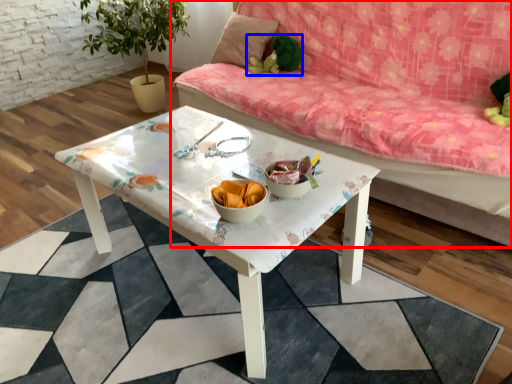
Question: Which object appears farthest to the camera in this image, studio couch (highlighted by a red box) or toy (highlighted by a blue box)?

Choices:
 (A) studio couch
 (B) toy

Answer: (B)